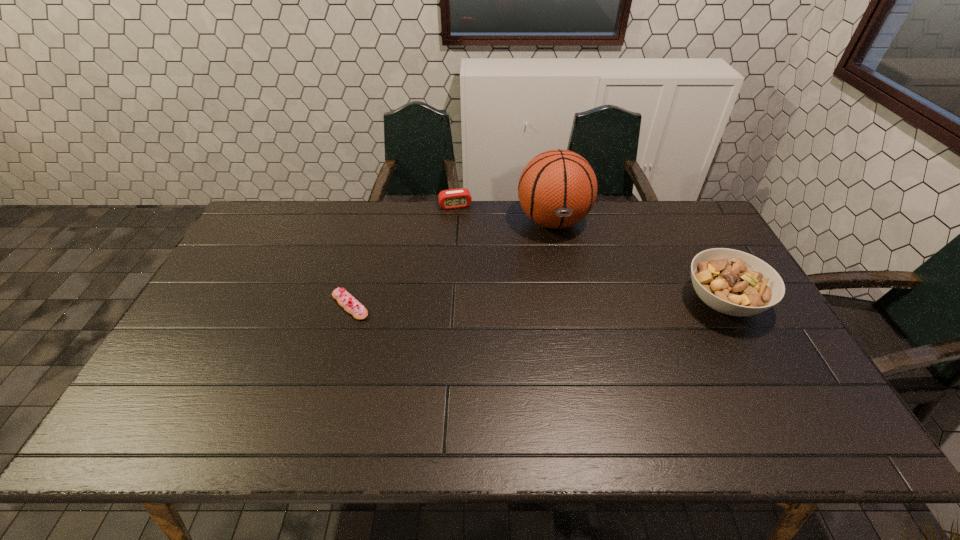
You are a GUI agent. You are given a task and a screenshot of the screen. Output one action in this format:
    pyautogui.click(x=<x>, y=<y>)
    Task: Click on the free space on the desktop that is between the leftmost object and the third shortest object and is positioned on the side where the inflation valve is located
    
    Given the screenshot: What is the action you would take?
    pyautogui.click(x=575, y=303)

Locate an element on the screen. free space on the desktop that is between the eclair and the stew and is positioned on the front-facing side of the alarm clock is located at coordinates (484, 304).